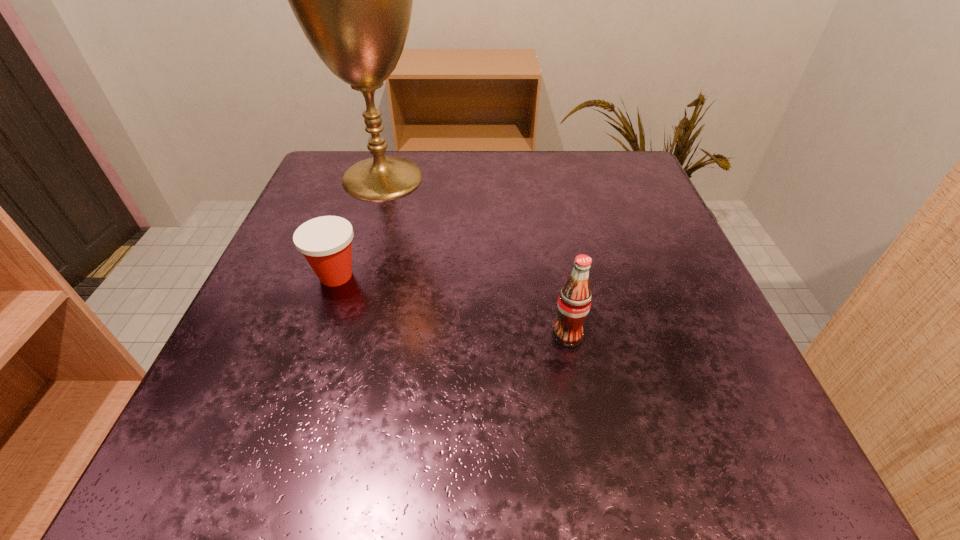
Image resolution: width=960 pixels, height=540 pixels. I want to click on the tallest object, so click(x=353, y=0).

The width and height of the screenshot is (960, 540). In order to click on trophy cup in this screenshot , I will do `click(353, 0)`.

Locate an element on the screen. The height and width of the screenshot is (540, 960). the nearest object is located at coordinates (574, 302).

At what (x,y) coordinates should I click in order to perform the action: click on the second tallest object. Please return your answer as a coordinate pair (x, y). Image resolution: width=960 pixels, height=540 pixels. Looking at the image, I should click on (574, 302).

The width and height of the screenshot is (960, 540). What are the coordinates of `the second farthest object` in the screenshot? It's located at (326, 242).

Image resolution: width=960 pixels, height=540 pixels. What are the coordinates of `Dixie cup` in the screenshot? It's located at (326, 242).

Where is `vacant area located 0.100m on the front of the farthest object`? This screenshot has height=540, width=960. vacant area located 0.100m on the front of the farthest object is located at coordinates (365, 238).

Find the location of a particular element. The width and height of the screenshot is (960, 540). vacant space located on the back of the soda is located at coordinates (544, 206).

The height and width of the screenshot is (540, 960). I want to click on vacant space located 0.110m on the front of the second farthest object, so click(312, 348).

The height and width of the screenshot is (540, 960). I want to click on object that is at the far edge, so click(353, 0).